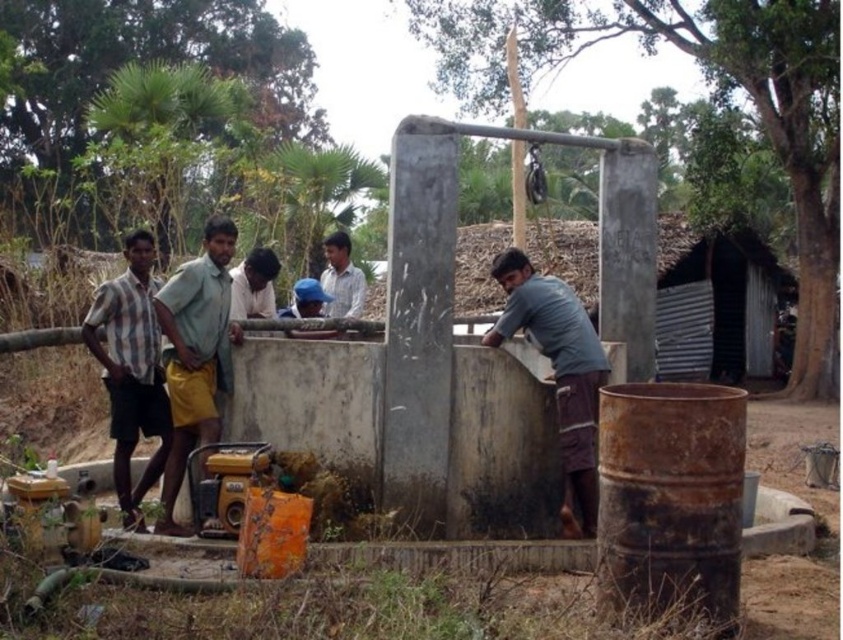
Consider the image. You are observing two workers in the scene. The striped cotton shirt at left and the light brown shirt at center are both visible. Which worker is wearing a wider shirt?

The striped cotton shirt at left is wider than the light brown shirt at center.

Based on the scene description, where is the striped cotton shirt at left located in terms of its 2D coordinates?

The striped cotton shirt at left is located at the 2D coordinates point [132,369].

Based on the photo, you are standing in the rural outdoor setting looking at the water pump structure. There are two points marked on the structure. One is at coordinate point (117, 438) and the other at point (232, 285). Which point is nearer to you?

Point (117, 438) is closer to the camera than point (232, 285), so the point at (117, 438) is nearer to you.